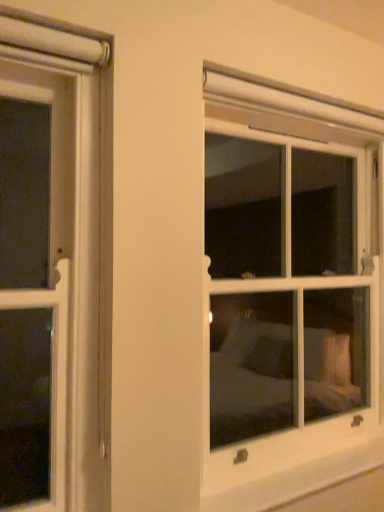
Image resolution: width=384 pixels, height=512 pixels. Describe the element at coordinates (311, 228) in the screenshot. I see `clear glass window at center` at that location.

Locate an element on the screen. clear glass window at center is located at coordinates (311, 228).

Identify the location of white plastic window sill at lower right. The width and height of the screenshot is (384, 512). (299, 480).

The height and width of the screenshot is (512, 384). What do you see at coordinates (299, 480) in the screenshot? I see `white plastic window sill at lower right` at bounding box center [299, 480].

You are a GUI agent. You are given a task and a screenshot of the screen. Output one action in this format:
    pyautogui.click(x=<x>, y=<y>)
    Task: Click on the clear glass window at center
    The width and height of the screenshot is (384, 512).
    Given the screenshot: What is the action you would take?
    pyautogui.click(x=311, y=228)

Considering the relative positions of white plastic window sill at lower right and clear glass window at center in the image provided, is white plastic window sill at lower right to the right of clear glass window at center from the viewer's perspective?

Correct, you'll find white plastic window sill at lower right to the right of clear glass window at center.

Between white plastic window sill at lower right and clear glass window at center, which one is positioned behind?

clear glass window at center is behind.

Is point (342, 454) farther from camera compared to point (360, 138)?

No, it is in front of (360, 138).

From the image's perspective, is white plastic window sill at lower right positioned above or below clear glass window at center?

From the image's perspective, white plastic window sill at lower right appears below clear glass window at center.

From a real-world perspective, is white plastic window sill at lower right on top of clear glass window at center?

No, from a real-world perspective, white plastic window sill at lower right is not over clear glass window at center

Considering the sizes of white plastic window sill at lower right and clear glass window at center in the image, is white plastic window sill at lower right wider or thinner than clear glass window at center?

white plastic window sill at lower right is thinner than clear glass window at center.

Can you confirm if white plastic window sill at lower right is taller than clear glass window at center?

In fact, white plastic window sill at lower right may be shorter than clear glass window at center.

Which of these two, white plastic window sill at lower right or clear glass window at center, is smaller?

white plastic window sill at lower right is smaller.

Could clear glass window at center be considered to be inside white plastic window sill at lower right?

That's incorrect, clear glass window at center is not inside white plastic window sill at lower right.

Is white plastic window sill at lower right beside clear glass window at center?

No, white plastic window sill at lower right is not with clear glass window at center.

Looking at this image, is white plastic window sill at lower right looking in the opposite direction of clear glass window at center?

No, white plastic window sill at lower right is not facing the opposite direction of clear glass window at center.

Can you tell me how much white plastic window sill at lower right and clear glass window at center differ in facing direction?

The angular difference between white plastic window sill at lower right and clear glass window at center is 0.00445 degrees.

You are a GUI agent. You are given a task and a screenshot of the screen. Output one action in this format:
    pyautogui.click(x=<x>, y=<y>)
    Task: Click on the window above the white plastic window sill at lower right (from the image's perspective)
    
    Given the screenshot: What is the action you would take?
    pyautogui.click(x=311, y=228)

Considering the positions of objects clear glass window at center and white plastic window sill at lower right in the image provided, who is more to the right, clear glass window at center or white plastic window sill at lower right?

white plastic window sill at lower right is more to the right.

Considering the relative positions of clear glass window at center and white plastic window sill at lower right in the image provided, is clear glass window at center in front of white plastic window sill at lower right?

That is False.

Considering the points (334, 242) and (227, 496), which point is behind, point (334, 242) or point (227, 496)?

The point (334, 242) is behind.

From the image's perspective, which object appears higher, clear glass window at center or white plastic window sill at lower right?

clear glass window at center is shown above in the image.

From a real-world perspective, is clear glass window at center under white plastic window sill at lower right?

No, from a real-world perspective, clear glass window at center is not beneath white plastic window sill at lower right.

Considering the sizes of clear glass window at center and white plastic window sill at lower right in the image, is clear glass window at center wider or thinner than white plastic window sill at lower right?

clear glass window at center is wider than white plastic window sill at lower right.

From the picture: Considering the relative sizes of clear glass window at center and white plastic window sill at lower right in the image provided, is clear glass window at center taller than white plastic window sill at lower right?

Correct, clear glass window at center is much taller as white plastic window sill at lower right.

Is clear glass window at center bigger or smaller than white plastic window sill at lower right?

clear glass window at center is bigger than white plastic window sill at lower right.

Consider the image. Would you say clear glass window at center is inside or outside white plastic window sill at lower right?

The correct answer is: outside.

Is clear glass window at center not near white plastic window sill at lower right?

clear glass window at center is positioned a significant distance from white plastic window sill at lower right.

Does clear glass window at center turn towards white plastic window sill at lower right?

No, clear glass window at center is not aimed at white plastic window sill at lower right.

Can you tell me how much clear glass window at center and white plastic window sill at lower right differ in facing direction?

The facing directions of clear glass window at center and white plastic window sill at lower right are 0.00445 degrees apart.

The width and height of the screenshot is (384, 512). I want to click on window above the white plastic window sill at lower right (from the image's perspective), so click(x=311, y=228).

I want to click on window that is above the white plastic window sill at lower right (from the image's perspective), so click(311, 228).

The image size is (384, 512). Identify the location of window on the left of white plastic window sill at lower right. (311, 228).